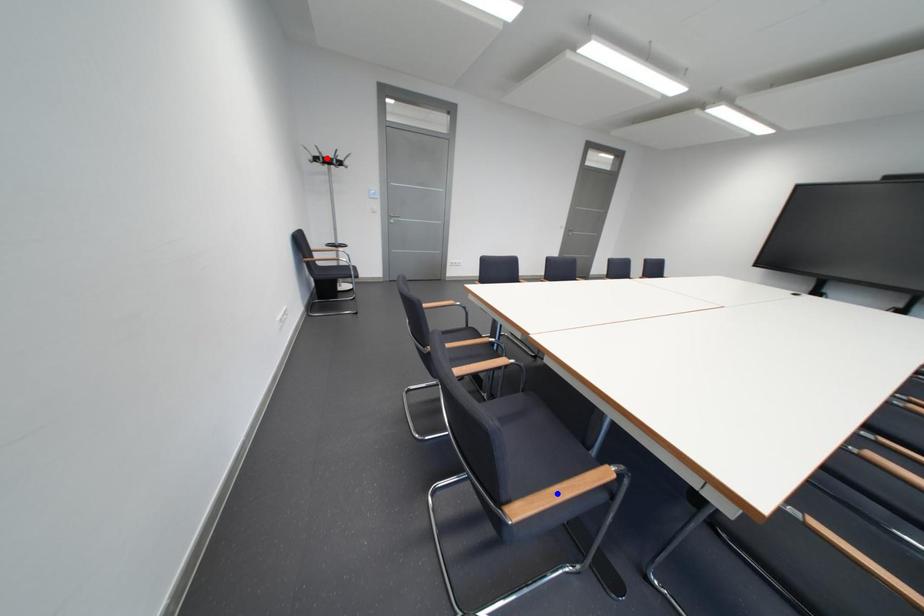
Question: In the image, two points are highlighted. Which point is nearer to the camera? Reply with the corresponding letter.

Choices:
 (A) blue point
 (B) red point

Answer: (A)